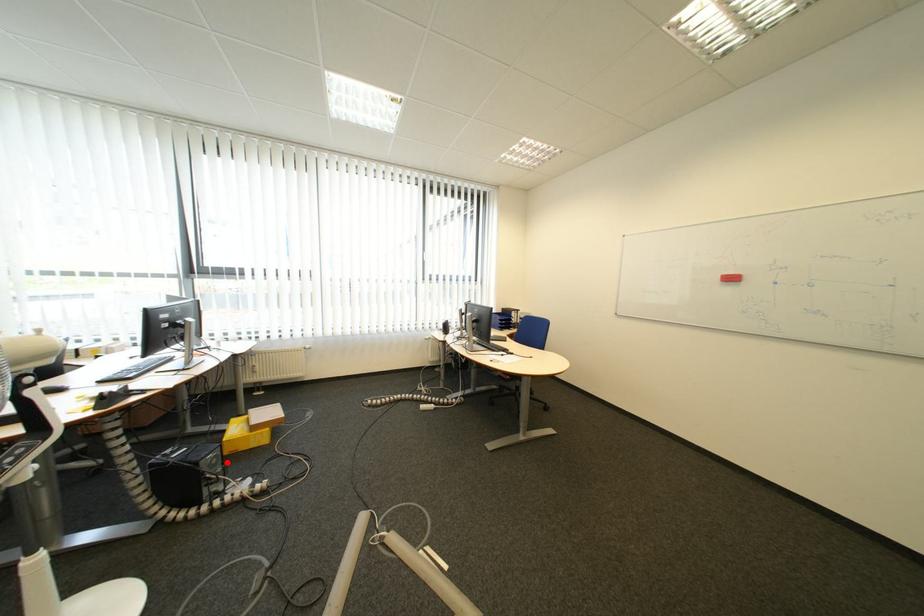
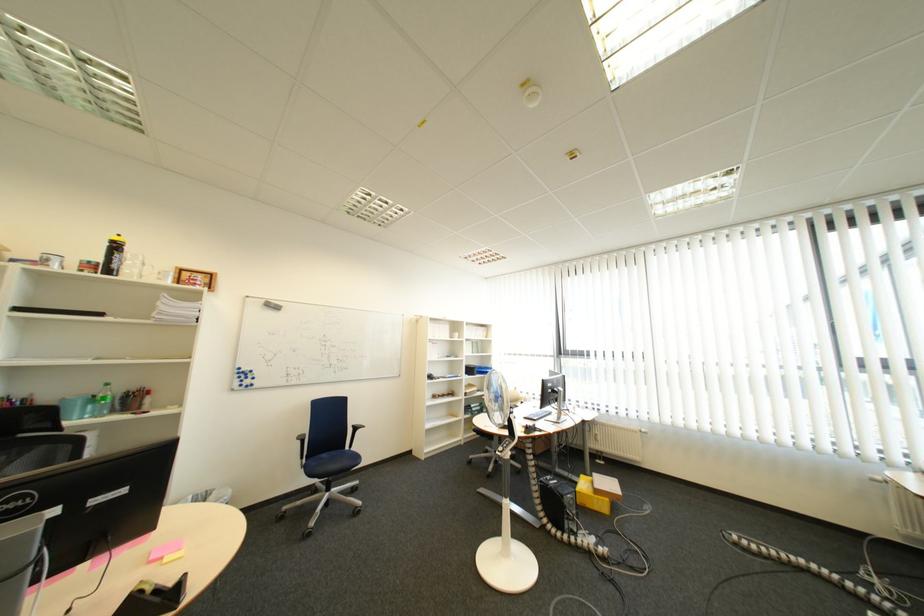
Question: A red point is marked in image1. In image2, is the corresponding 3D point closer to the camera or farther? Reply with the corresponding letter.

Choices:
 (A) The corresponding 3D point is closer.
 (B) The corresponding 3D point is farther.

Answer: (B)